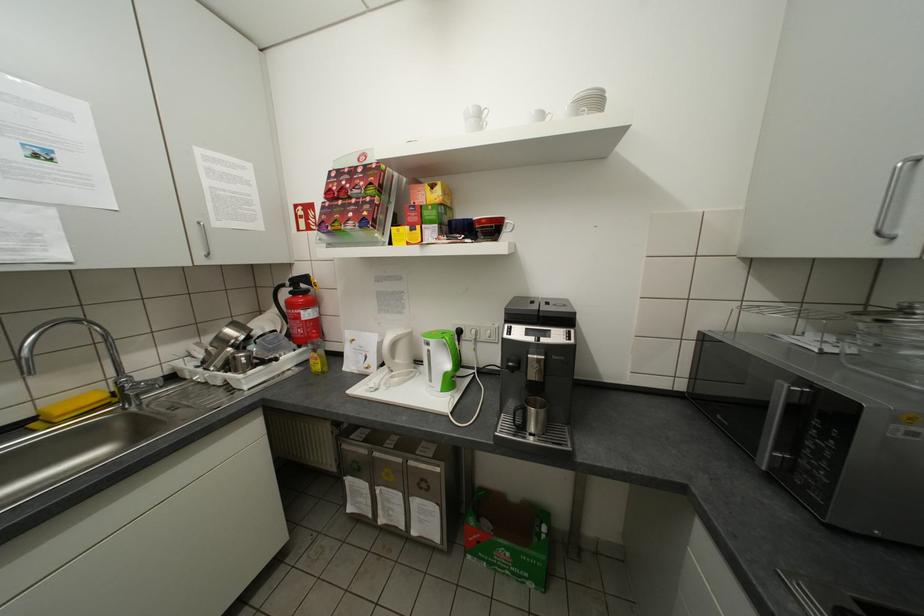
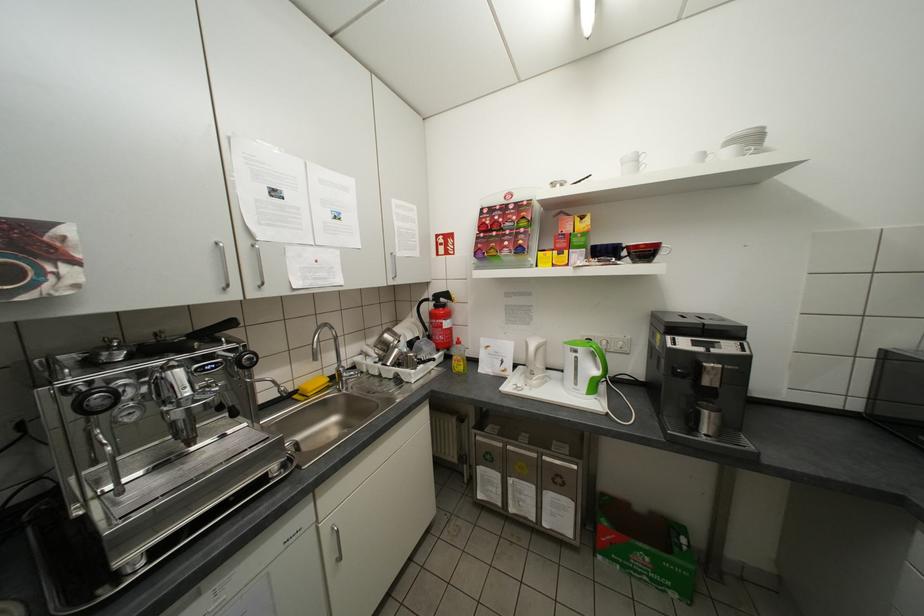
The point at (492, 222) is marked in the first image. Where is the corresponding point in the second image?

(650, 246)